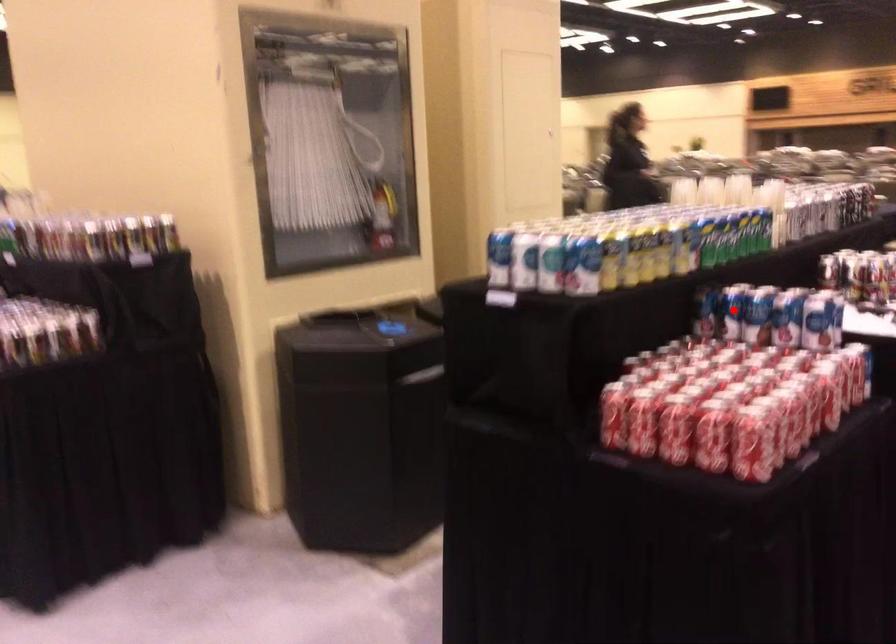
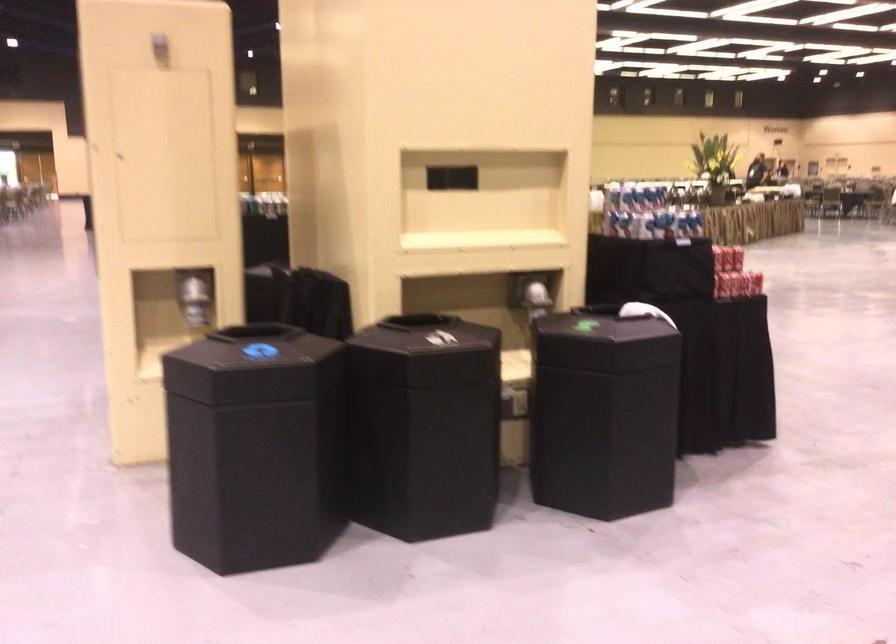
Question: I am providing you with two images of the same scene from different viewpoints. A red point is marked on the first image. At the location where the point appears in image 1, is it still visible in image 2?

Choices:
 (A) Yes
 (B) No

Answer: (B)